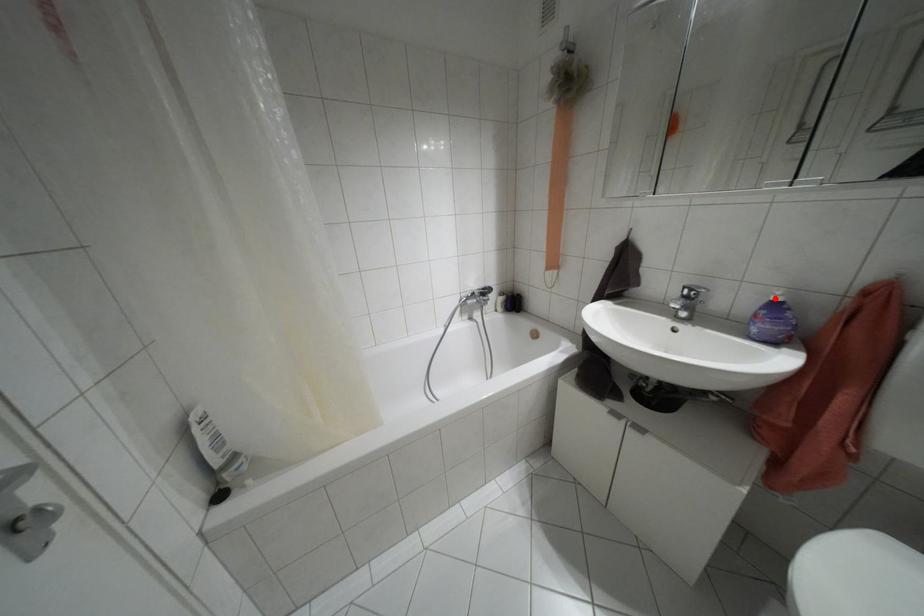
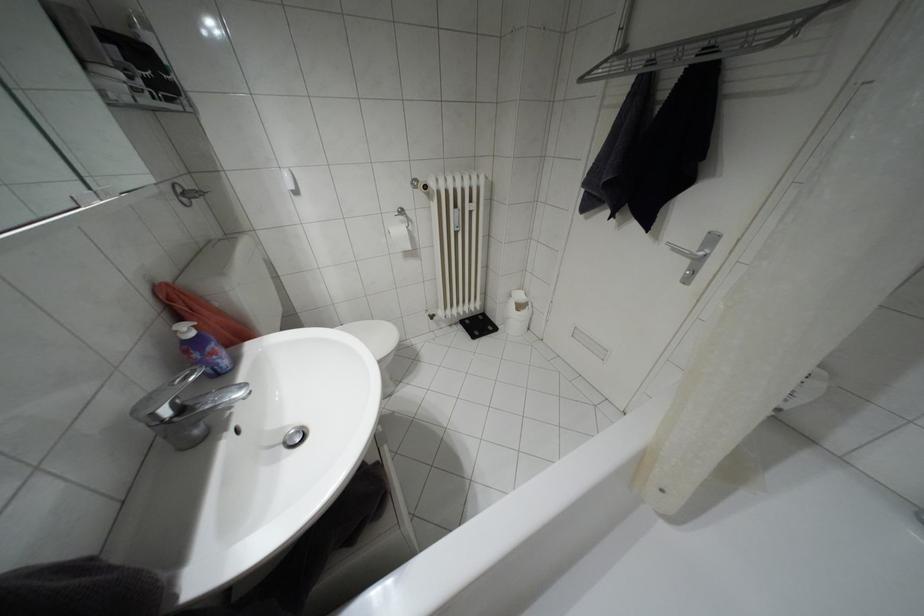
Where in the second image is the point corresponding to the highlighted location from the first image?

(190, 333)